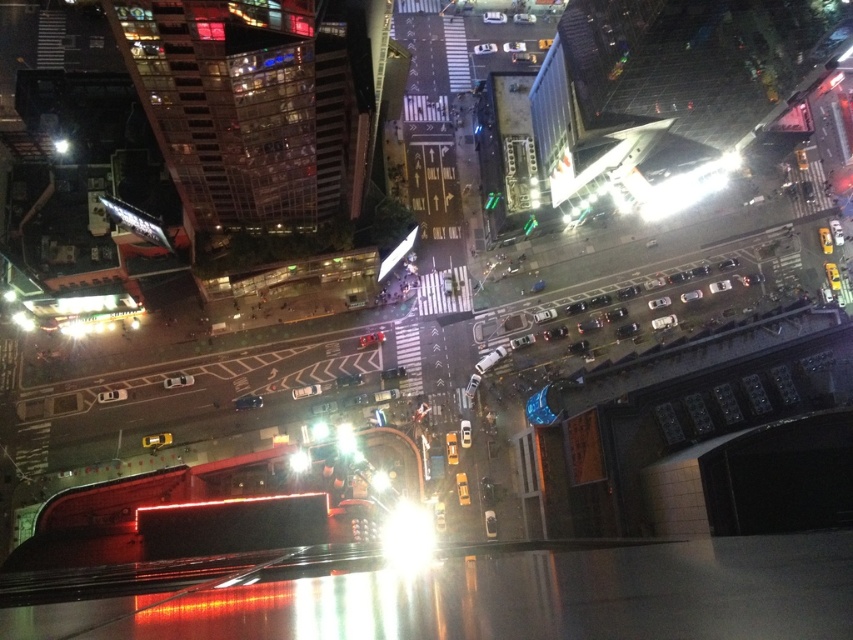
Does bright metallic light at center appear under shiny black car at center?

Yes.

Which is behind, point (300, 460) or point (258, 401)?

The point (258, 401) is behind.

Where is `bright metallic light at center`? The width and height of the screenshot is (853, 640). bright metallic light at center is located at coordinates (299, 461).

Can you confirm if bright white light at center is taller than bright metallic light at center?

Yes, bright white light at center is taller than bright metallic light at center.

Who is more forward, (392, 529) or (300, 460)?

Point (392, 529) is in front.

Where is `bright white light at center`? bright white light at center is located at coordinates [x=408, y=536].

How distant is transparent glass light at center from shiny black car at center?

transparent glass light at center is 15.75 meters from shiny black car at center.

Between transparent glass light at center and shiny black car at center, which one is positioned lower?

transparent glass light at center

Is point (341, 452) positioned in front of point (260, 401)?

Yes, point (341, 452) is in front of point (260, 401).

Where is `transparent glass light at center`? transparent glass light at center is located at coordinates (345, 440).